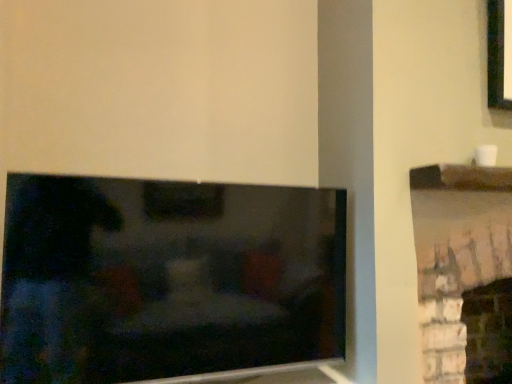
In order to click on matte black tv at center in this screenshot , I will do `click(168, 280)`.

Describe the element at coordinates (168, 280) in the screenshot. I see `matte black tv at center` at that location.

Where is `matte black tv at center`? Image resolution: width=512 pixels, height=384 pixels. matte black tv at center is located at coordinates (168, 280).